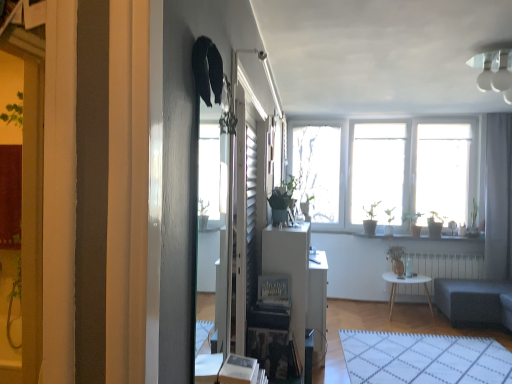
The width and height of the screenshot is (512, 384). Describe the element at coordinates (498, 197) in the screenshot. I see `gray fabric curtain at right` at that location.

What do you see at coordinates (318, 305) in the screenshot? I see `white glossy table at center` at bounding box center [318, 305].

The width and height of the screenshot is (512, 384). Find the location of `white radiator at center`. white radiator at center is located at coordinates (446, 266).

What do you see at coordinates (406, 283) in the screenshot? This screenshot has height=384, width=512. I see `white wooden table at center` at bounding box center [406, 283].

The image size is (512, 384). Describe the element at coordinates (421, 236) in the screenshot. I see `white glossy window sill at center` at that location.

The width and height of the screenshot is (512, 384). In order to click on gray fabric curtain at right in this screenshot , I will do coord(498,197).

Based on the photo, is white wooden table at center looking in the opposite direction of white radiator at center?

Yes.

What's the angular difference between white wooden table at center and white radiator at center's facing directions?

The facing directions of white wooden table at center and white radiator at center are 0.41 degrees apart.

Find the location of `desk located underneath the white radiator at center (from a real-world perspective)`. desk located underneath the white radiator at center (from a real-world perspective) is located at coordinates (406, 283).

Is white wooden table at center outside of white radiator at center?

Yes, white wooden table at center is not within white radiator at center.

Which object is positioned more to the right, white glossy table at center or white glossy window sill at center?

Positioned to the right is white glossy window sill at center.

Is white glossy table at center facing towards white glossy window sill at center?

No, white glossy table at center is not facing towards white glossy window sill at center.

From a real-world perspective, does white glossy table at center stand above white glossy window sill at center?

No, from a real-world perspective, white glossy table at center is not over white glossy window sill at center

Does white glossy table at center have a larger size compared to white glossy window sill at center?

Indeed, white glossy table at center has a larger size compared to white glossy window sill at center.

Can we say white glossy light fixture at upper right lies outside white glossy window sill at center?

white glossy light fixture at upper right is positioned outside white glossy window sill at center.

Visually, is white glossy light fixture at upper right positioned to the left or to the right of white glossy window sill at center?

white glossy light fixture at upper right is to the left of white glossy window sill at center.

From a real-world perspective, which is physically below, white glossy light fixture at upper right or white glossy window sill at center?

white glossy window sill at center is physically lower.

Which of these two, white glossy light fixture at upper right or white glossy window sill at center, is smaller?

With smaller size is white glossy window sill at center.

Could you tell me if dark gray fabric studio couch at lower right is facing white grid rug at lower center?

Yes, dark gray fabric studio couch at lower right is oriented towards white grid rug at lower center.

In terms of size, does dark gray fabric studio couch at lower right appear bigger or smaller than white grid rug at lower center?

In the image, dark gray fabric studio couch at lower right appears to be larger than white grid rug at lower center.

Is point (476, 304) positioned after point (439, 352)?

Yes, point (476, 304) is farther from viewer.

How different are the orientations of dark gray fabric studio couch at lower right and white grid rug at lower center in degrees?

The facing directions of dark gray fabric studio couch at lower right and white grid rug at lower center are 87.9 degrees apart.

Is green matte plant at center, the 1th houseplant positioned from the left, at the back of white grid rug at lower center?

white grid rug at lower center does not have its back to green matte plant at center, the 1th houseplant positioned from the left.

Can you confirm if white grid rug at lower center is thinner than green matte plant at center, which ranks as the 2th houseplant in right-to-left order?

In fact, white grid rug at lower center might be wider than green matte plant at center, which ranks as the 2th houseplant in right-to-left order.

Is white grid rug at lower center bigger or smaller than green matte plant at center, which ranks as the 2th houseplant in right-to-left order?

Considering their sizes, white grid rug at lower center takes up more space than green matte plant at center, which ranks as the 2th houseplant in right-to-left order.

Between white grid rug at lower center and green matte plant at center, which ranks as the 2th houseplant in right-to-left order, which one is positioned behind?

green matte plant at center, which ranks as the 2th houseplant in right-to-left order, is further away from the camera.

Between white glossy light fixture at upper right and gray fabric curtain at right, which one has more height?

gray fabric curtain at right is taller.

From the image's perspective, is white glossy light fixture at upper right beneath gray fabric curtain at right?

No.

Is white glossy light fixture at upper right to the right of gray fabric curtain at right from the viewer's perspective?

No, white glossy light fixture at upper right is not to the right of gray fabric curtain at right.

Is white glossy light fixture at upper right behind gray fabric curtain at right?

No.

The image size is (512, 384). Identify the location of curtain that appears below the white glossy light fixture at upper right (from a real-world perspective). (498, 197).

From the image's perspective, is gray fabric curtain at right located above or below white glossy light fixture at upper right?

gray fabric curtain at right is below white glossy light fixture at upper right.

Can you tell me how much gray fabric curtain at right and white glossy light fixture at upper right differ in facing direction?

2.77 degrees separate the facing orientations of gray fabric curtain at right and white glossy light fixture at upper right.

Between gray fabric curtain at right and white glossy light fixture at upper right, which one has larger size?

With larger size is gray fabric curtain at right.

The width and height of the screenshot is (512, 384). Find the location of `desk in front of the white radiator at center`. desk in front of the white radiator at center is located at coordinates (406, 283).

You are a GUI agent. You are given a task and a screenshot of the screen. Output one action in this format:
    pyautogui.click(x=<x>, y=<y>)
    Task: Click on the window sill that appears above the white glossy table at center (from a real-world perspective)
    The height and width of the screenshot is (384, 512).
    Given the screenshot: What is the action you would take?
    pyautogui.click(x=421, y=236)

Considering their positions, is white grid rug at lower center positioned further to gray fabric curtain at right than green matte plant at center, positioned as the second houseplant in left-to-right order?

white grid rug at lower center is further to gray fabric curtain at right.

From the image, which object appears to be farther from white wooden table at center, dark gray fabric studio couch at lower right or white radiator at center?

dark gray fabric studio couch at lower right.

Which object lies further to the anchor point white grid rug at lower center, white glossy window sill at center or white radiator at center?

Based on the image, white glossy window sill at center appears to be further to white grid rug at lower center.

Looking at this image, looking at the image, which one is located closer to dark gray fabric studio couch at lower right, white glossy light fixture at upper right or green matte plant at center, the 1th houseplant positioned from the left?

Based on the image, green matte plant at center, the 1th houseplant positioned from the left, appears to be nearer to dark gray fabric studio couch at lower right.

Considering their positions, is white glossy table at center positioned further to dark gray fabric studio couch at lower right than white radiator at center?

white glossy table at center is positioned further to the anchor dark gray fabric studio couch at lower right.

When comparing their distances from green matte plant at center, positioned as the second houseplant in left-to-right order, does white grid rug at lower center or white glossy window sill at center seem further?

The object further to green matte plant at center, positioned as the second houseplant in left-to-right order, is white grid rug at lower center.

Estimate the real-world distances between objects in this image. Which object is closer to white glossy light fixture at upper right, white grid rug at lower center or green matte plant at center, the 1th houseplant positioned from the left?

green matte plant at center, the 1th houseplant positioned from the left.

Based on their spatial positions, is white glossy light fixture at upper right or white glossy table at center closer to white wooden table at center?

white glossy table at center.

At what (x,y) coordinates should I click in order to perform the action: click on window sill between white glossy table at center and dark gray fabric studio couch at lower right in the horizontal direction. Please return your answer as a coordinate pair (x, y). This screenshot has width=512, height=384. Looking at the image, I should click on (421, 236).

You are a GUI agent. You are given a task and a screenshot of the screen. Output one action in this format:
    pyautogui.click(x=<x>, y=<y>)
    Task: Click on the window sill located between white glossy table at center and green matte plant at center, positioned as the second houseplant in left-to-right order, in the depth direction
    The image size is (512, 384).
    Given the screenshot: What is the action you would take?
    pyautogui.click(x=421, y=236)

Where is `houseplant located between white glossy light fixture at upper right and white wooden table at center in the depth direction`? houseplant located between white glossy light fixture at upper right and white wooden table at center in the depth direction is located at coordinates (283, 201).

Identify the location of radiator between green matte plant at center, the 1th houseplant in the back-to-front sequence, and white wooden table at center vertically. (446, 266).